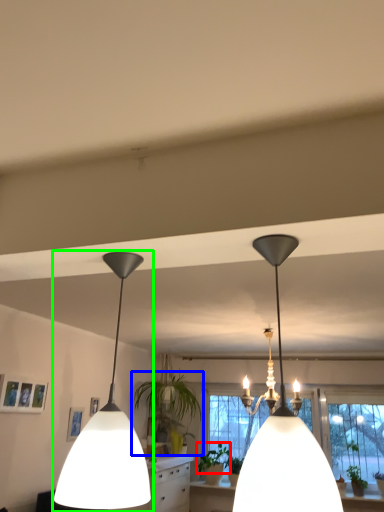
Question: Which object is the farthest from plant (highlighted by a red box)? Choose among these: houseplant (highlighted by a blue box) or lamp (highlighted by a green box).

Choices:
 (A) houseplant
 (B) lamp

Answer: (B)